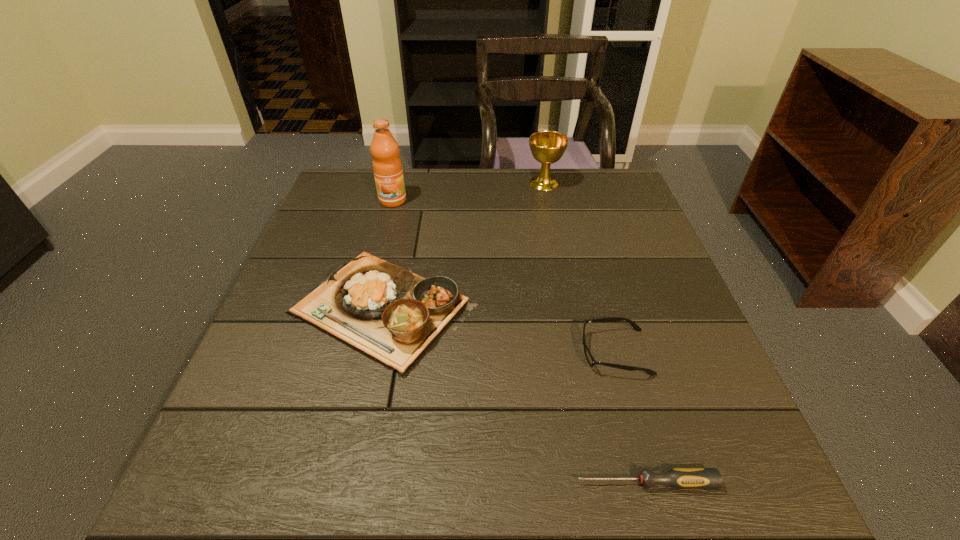
At what (x,y) coordinates should I click in order to perform the action: click on vacant space situated on the right of the platter. Please return your answer as a coordinate pair (x, y). The height and width of the screenshot is (540, 960). Looking at the image, I should click on (528, 310).

The height and width of the screenshot is (540, 960). I want to click on vacant area located on the front-facing side of the fourth tallest object, so click(459, 352).

In order to click on blank space located 0.260m on the front-facing side of the fourth tallest object in this screenshot , I will do click(x=454, y=352).

The image size is (960, 540). In order to click on vacant area located 0.350m on the front-facing side of the fourth tallest object in this screenshot , I will do `click(409, 352)`.

Find the location of a particular element. This screenshot has height=540, width=960. vacant space positioned insert the shortest object into a screw head is located at coordinates (452, 483).

Identify the location of vacant space situated 0.340m insert the shortest object into a screw head. (365, 483).

Locate an element on the screen. free region located 0.180m insert the shortest object into a screw head is located at coordinates (465, 483).

The width and height of the screenshot is (960, 540). I want to click on fruit juice that is at the far edge, so click(x=387, y=166).

This screenshot has width=960, height=540. I want to click on chalice present at the far edge, so click(x=547, y=147).

I want to click on object that is at the near edge, so click(x=678, y=478).